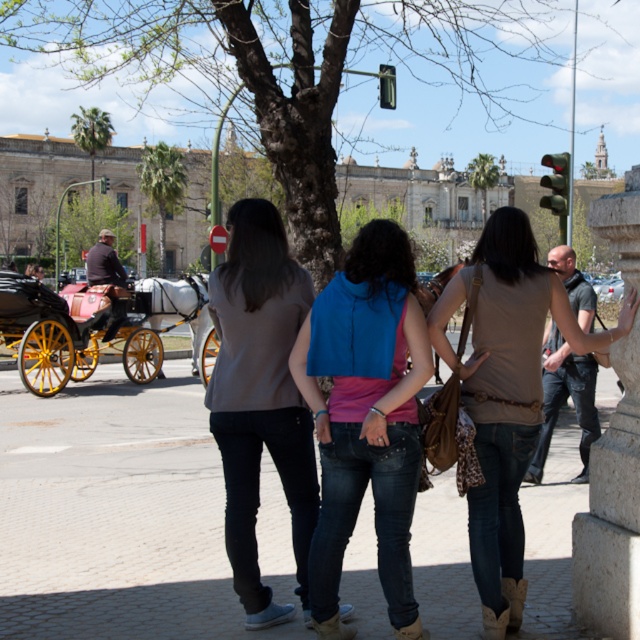
Can you confirm if matte gray shirt at center is bigger than brown leather coach at left?

Incorrect, matte gray shirt at center is not larger than brown leather coach at left.

Is matte gray shirt at center shorter than brown leather coach at left?

In fact, matte gray shirt at center may be taller than brown leather coach at left.

Which is behind, point (228, 358) or point (100, 244)?

The point (100, 244) is behind.

Where is `matte gray shirt at center`? The image size is (640, 640). matte gray shirt at center is located at coordinates (260, 397).

Measure the distance between matte brown vest at center and camera.

A distance of 12.97 meters exists between matte brown vest at center and camera.

Does matte brown vest at center have a greater height compared to brown leather backpack at center?

Yes, matte brown vest at center is taller than brown leather backpack at center.

This screenshot has height=640, width=640. I want to click on matte brown vest at center, so click(x=508, y=381).

Is cobblestone pavement at center taller than brown leather coach at left?

Correct, cobblestone pavement at center is much taller as brown leather coach at left.

What do you see at coordinates (115, 513) in the screenshot? Image resolution: width=640 pixels, height=640 pixels. I see `cobblestone pavement at center` at bounding box center [115, 513].

Is point (28, 618) farther from camera compared to point (113, 259)?

No, (28, 618) is in front of (113, 259).

Identify the location of cobblestone pavement at center. This screenshot has width=640, height=640. (115, 513).